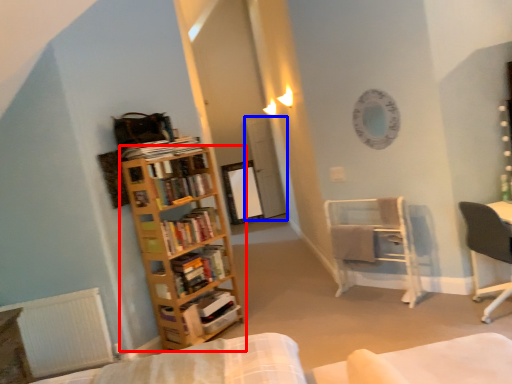
Question: Which object is closer to the camera taking this photo, bookcase (highlighted by a red box) or glass door (highlighted by a blue box)?

Choices:
 (A) bookcase
 (B) glass door

Answer: (A)